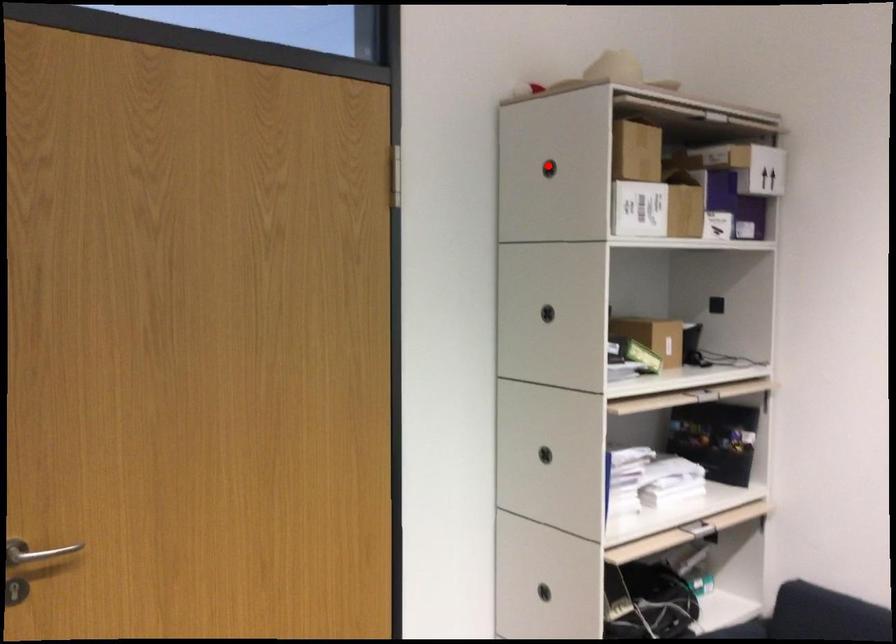
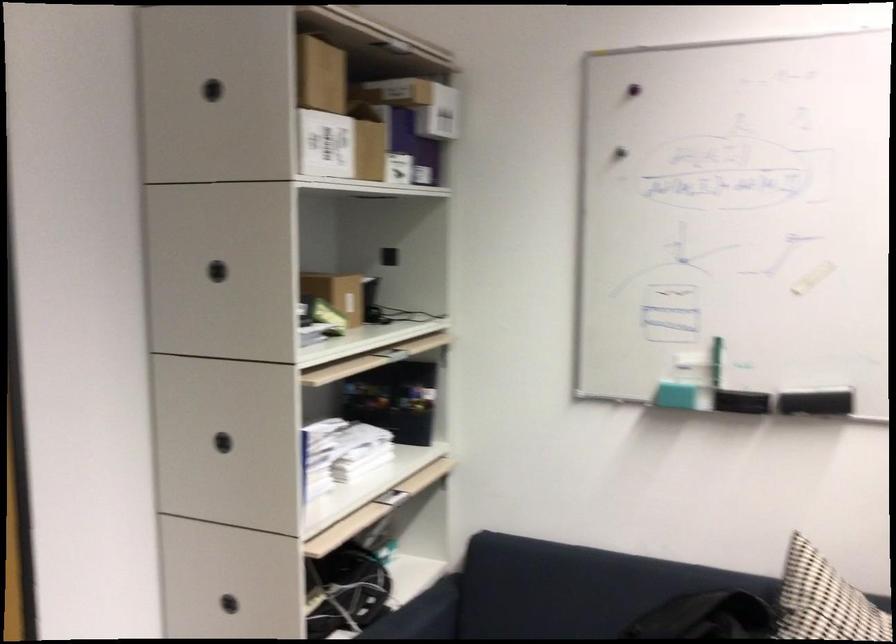
Question: I am providing you with two images of the same scene from different viewpoints. Image1 has a red point marked. In image2, the corresponding 3D location appears at what relative position? Reply with the corresponding letter.

Choices:
 (A) Closer
 (B) Farther

Answer: (A)